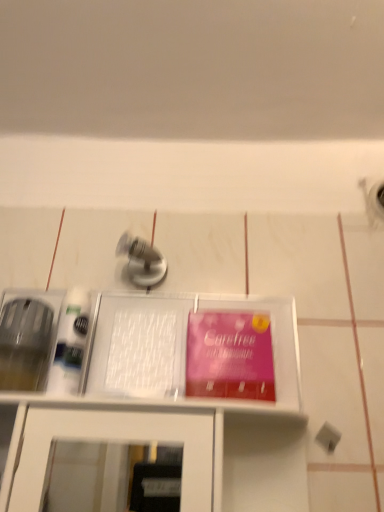
Question: Can you confirm if satin nickel faucet at center is thinner than white plastic tray at center?

Choices:
 (A) no
 (B) yes

Answer: (A)

Question: Can you confirm if satin nickel faucet at center is positioned to the left of white plastic tray at center?

Choices:
 (A) no
 (B) yes

Answer: (B)

Question: From a real-world perspective, is satin nickel faucet at center located beneath white plastic tray at center?

Choices:
 (A) no
 (B) yes

Answer: (A)

Question: Does satin nickel faucet at center have a greater width compared to white plastic tray at center?

Choices:
 (A) yes
 (B) no

Answer: (A)

Question: Considering the relative sizes of satin nickel faucet at center and white plastic tray at center in the image provided, is satin nickel faucet at center smaller than white plastic tray at center?

Choices:
 (A) yes
 (B) no

Answer: (A)

Question: From a real-world perspective, is pink matte paper at center above or below white plastic tray at center?

Choices:
 (A) below
 (B) above

Answer: (A)

Question: Is pink matte paper at center situated inside white plastic tray at center or outside?

Choices:
 (A) inside
 (B) outside

Answer: (B)

Question: Based on their sizes in the image, would you say pink matte paper at center is bigger or smaller than white plastic tray at center?

Choices:
 (A) big
 (B) small

Answer: (B)

Question: From their relative heights in the image, would you say pink matte paper at center is taller or shorter than white plastic tray at center?

Choices:
 (A) short
 (B) tall

Answer: (A)

Question: Is white plastic tray at center taller or shorter than pink matte paper at center?

Choices:
 (A) tall
 (B) short

Answer: (A)

Question: From the image's perspective, relative to pink matte paper at center, is white plastic tray at center above or below?

Choices:
 (A) above
 (B) below

Answer: (A)

Question: From a real-world perspective, is white plastic tray at center above or below pink matte paper at center?

Choices:
 (A) below
 (B) above

Answer: (B)

Question: Is point (41, 315) closer or farther from the camera than point (218, 357)?

Choices:
 (A) closer
 (B) farther

Answer: (B)

Question: Based on their positions, is satin nickel faucet at center located to the left or right of white plastic tray at center?

Choices:
 (A) right
 (B) left

Answer: (B)

Question: From the image's perspective, is satin nickel faucet at center located above or below white plastic tray at center?

Choices:
 (A) above
 (B) below

Answer: (A)